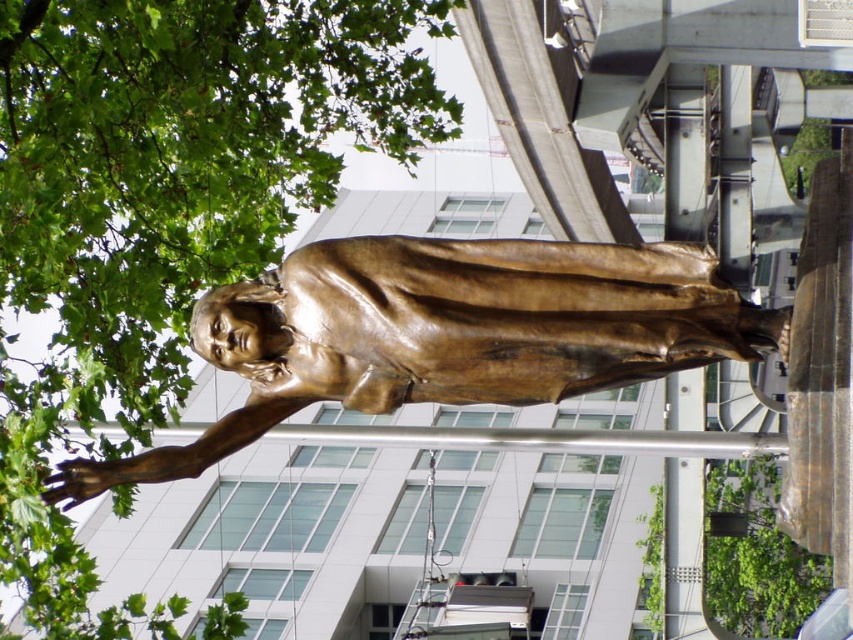
Question: Is the position of bronze statue at center more distant than that of green leafy tree at upper center?

Choices:
 (A) no
 (B) yes

Answer: (A)

Question: Considering the real-world distances, which object is farthest from the bronze statue at center?

Choices:
 (A) green leafy tree at upper left
 (B) green leafy tree at upper center

Answer: (B)

Question: Can you confirm if green leafy tree at upper left is positioned above green leafy tree at upper center?

Choices:
 (A) yes
 (B) no

Answer: (A)

Question: Which is farther from the green leafy tree at upper left?

Choices:
 (A) green leafy tree at upper center
 (B) bronze statue at center

Answer: (A)

Question: Is green leafy tree at upper left to the right of bronze statue at center from the viewer's perspective?

Choices:
 (A) yes
 (B) no

Answer: (B)

Question: Which point appears farthest from the camera in this image?

Choices:
 (A) (361, 308)
 (B) (646, 589)

Answer: (B)